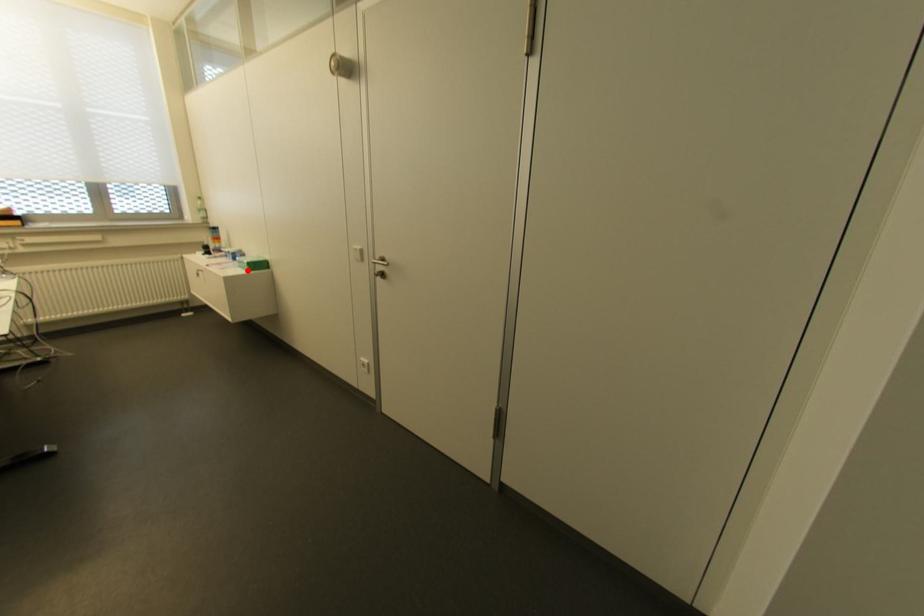
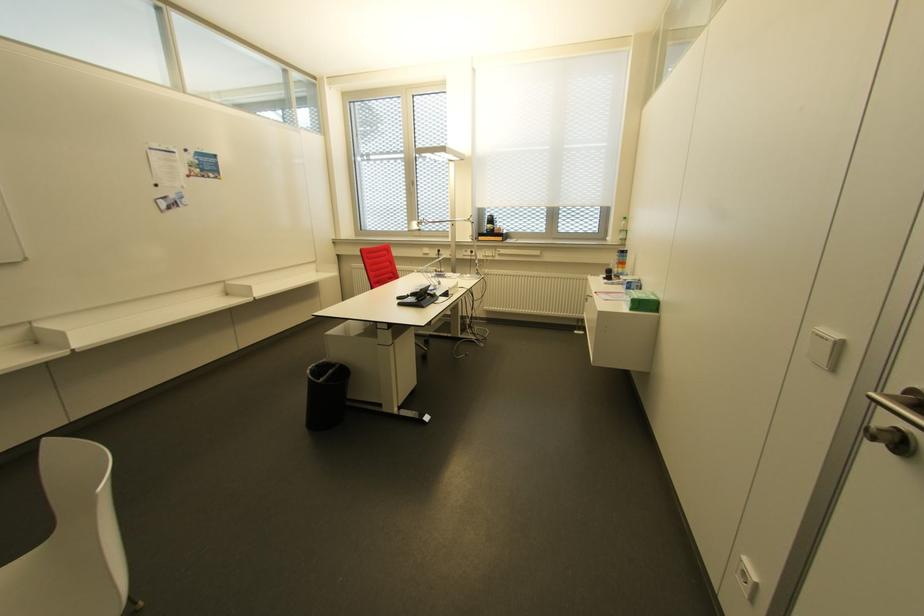
Find the pixel in the second image that matches the highlighted location in the first image.

(629, 310)